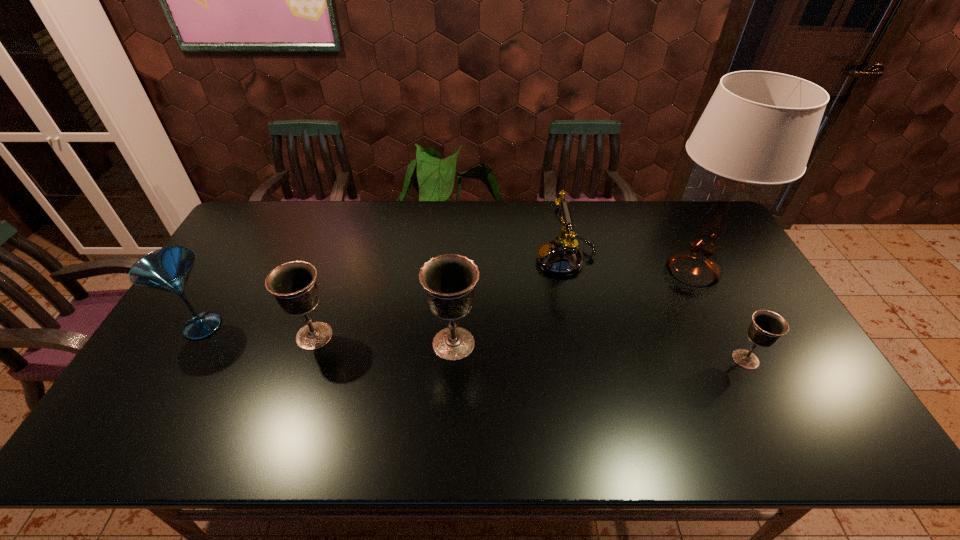
The image size is (960, 540). In order to click on vacant space that's between the telephone and the shortest chalice in this screenshot , I will do `click(656, 309)`.

Find the location of `blank region between the second chalice from right to left and the table lamp`. blank region between the second chalice from right to left and the table lamp is located at coordinates (573, 308).

The width and height of the screenshot is (960, 540). Identify the location of vacant space that is in between the leftmost object and the telephone. (384, 292).

Find the location of `unoccupied area between the shortest chalice and the table lamp`. unoccupied area between the shortest chalice and the table lamp is located at coordinates (x=719, y=315).

Identify which object is located as the second nearest to the tallest object. Please provide its 2D coordinates. Your answer should be formatted as a tuple, i.e. [(x, y)], where the tuple contains the x and y coordinates of a point satisfying the conditions above.

[(766, 328)]

You are a GUI agent. You are given a task and a screenshot of the screen. Output one action in this format:
    pyautogui.click(x=<x>, y=<y>)
    Task: Click on the third closest object relative to the shortest chalice
    This screenshot has width=960, height=540.
    Given the screenshot: What is the action you would take?
    pyautogui.click(x=449, y=280)

Locate which chalice is the third closest to the table lamp. Please provide its 2D coordinates. Your answer should be formatted as a tuple, i.e. [(x, y)], where the tuple contains the x and y coordinates of a point satisfying the conditions above.

[(293, 284)]

Locate which chalice is the closest to the third object from left to right. Please provide its 2D coordinates. Your answer should be formatted as a tuple, i.e. [(x, y)], where the tuple contains the x and y coordinates of a point satisfying the conditions above.

[(293, 284)]

You are a GUI agent. You are given a task and a screenshot of the screen. Output one action in this format:
    pyautogui.click(x=<x>, y=<y>)
    Task: Click on the free location that satisfies the following two spatial constraints: 1. on the dial of the shortest chalice; 2. on the left side of the telephone
    The height and width of the screenshot is (540, 960).
    Given the screenshot: What is the action you would take?
    pyautogui.click(x=587, y=359)

Where is `vacant space that satisfies the following two spatial constraints: 1. on the front-facing side of the table lamp; 2. on the right side of the shortest chalice`? This screenshot has height=540, width=960. vacant space that satisfies the following two spatial constraints: 1. on the front-facing side of the table lamp; 2. on the right side of the shortest chalice is located at coordinates (736, 359).